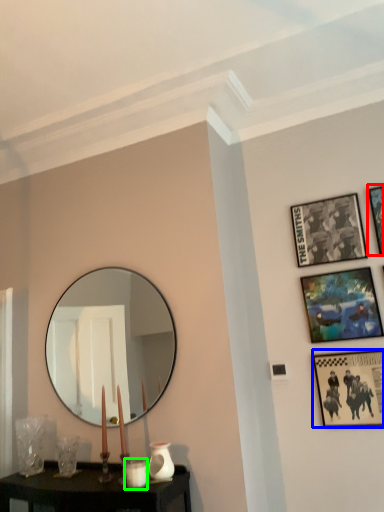
Question: Which is nearer to the picture frame (highlighted by a red box)? picture frame (highlighted by a blue box) or candle holder (highlighted by a green box).

Choices:
 (A) picture frame
 (B) candle holder

Answer: (A)